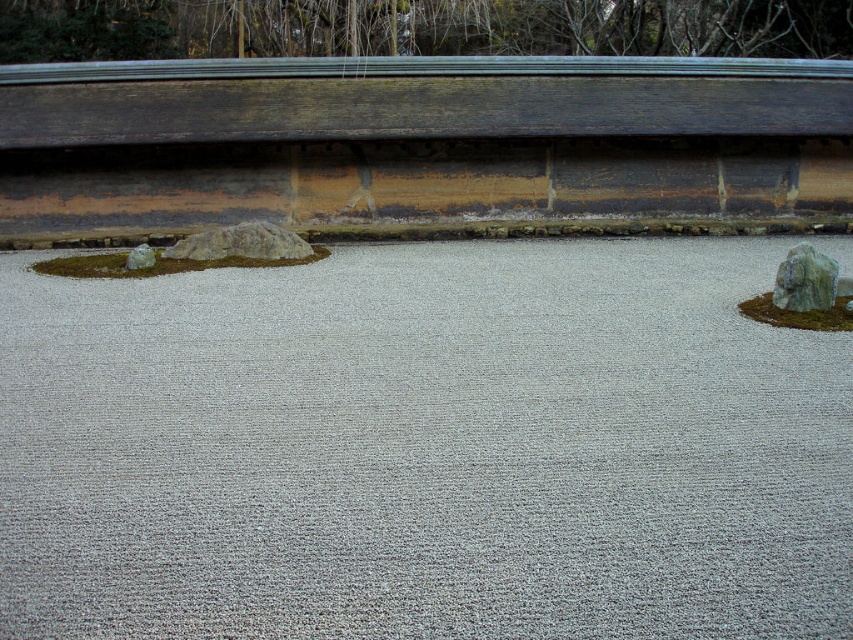
Question: Can you confirm if gray rough rock at center is positioned below smooth gray rock at left?

Choices:
 (A) no
 (B) yes

Answer: (A)

Question: Does gray gravel at center appear over green mossy rock at right?

Choices:
 (A) no
 (B) yes

Answer: (A)

Question: Which is nearer to the gray gravel at center?

Choices:
 (A) gray rough rock at center
 (B) smooth gray rock at left
 (C) green mossy rock at right

Answer: (C)

Question: From the image, what is the correct spatial relationship of green moss at left in relation to smooth gray rock at left?

Choices:
 (A) below
 (B) above

Answer: (B)

Question: Which point is closer to the camera?

Choices:
 (A) coord(799,278)
 (B) coord(851,576)
 (C) coord(148,266)

Answer: (B)

Question: Which point appears farthest from the camera in this image?

Choices:
 (A) (822, 317)
 (B) (142, 259)
 (C) (258, 253)

Answer: (C)